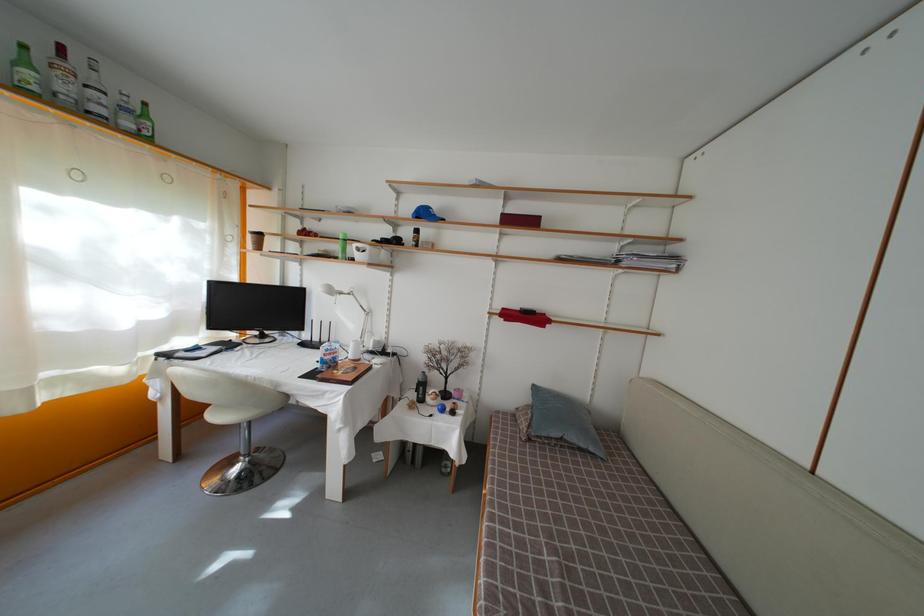
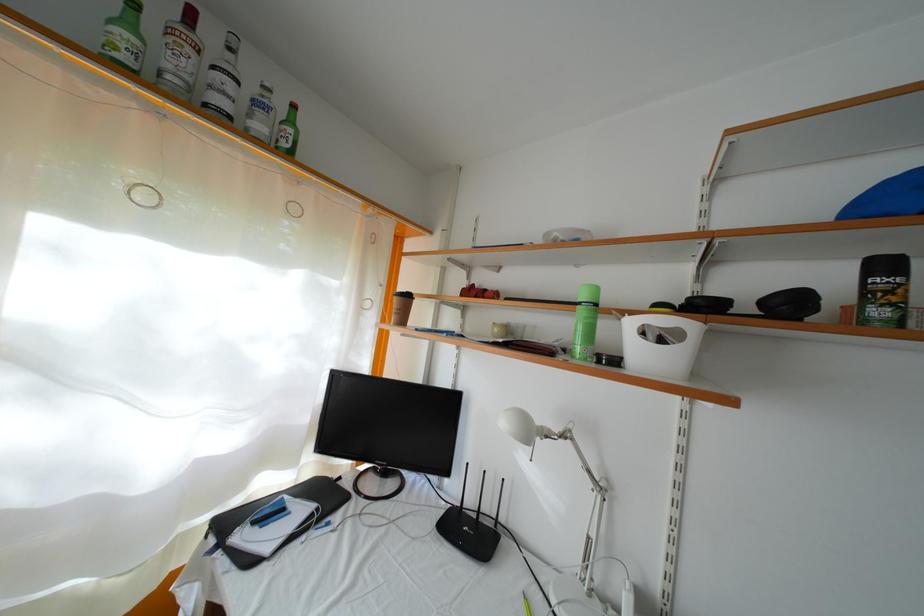
The point at [422,238] is marked in the first image. Where is the corresponding point in the second image?

(891, 273)